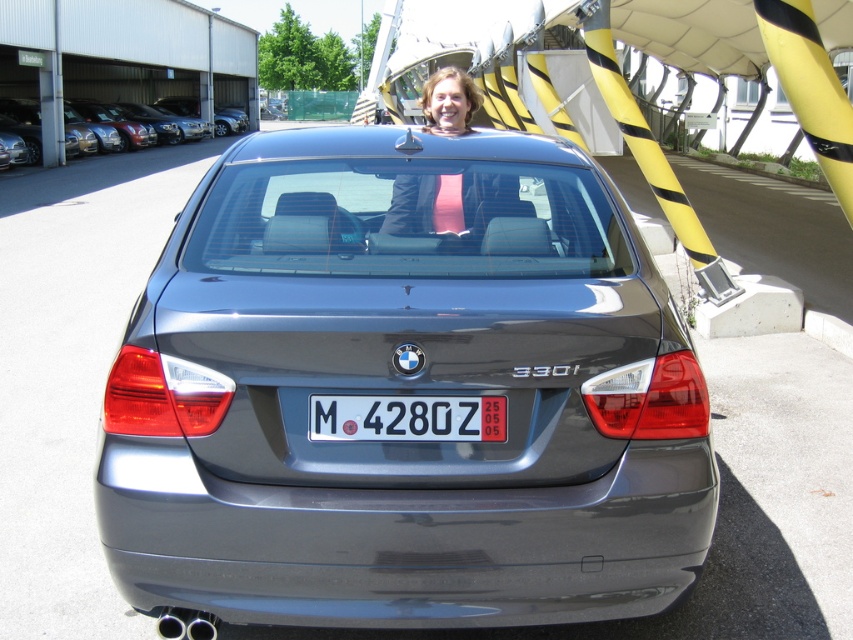
You are a parking attendant who needs to verify the license plate of the satin metallic sedan at upper left. From your current position, where would you look to find the white plastic license plate at center?

The white plastic license plate at center is located below the satin metallic sedan at upper left, so you should look downward from the position of the satin metallic sedan at upper left to find it.

You are a delivery person trying to park your van in the parking area behind the satin metallic car at center and the pink fabric at center. Since both are at the center, which one should you avoid hitting when backing up?

The satin metallic car at center is located below the pink fabric at center, so when backing up, you should avoid hitting the pink fabric at center first as it is higher up and closer to your van.